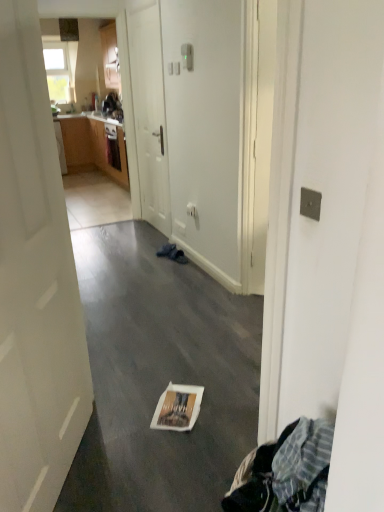
Where is `free space below white glossy magazine at center (from a real-world perspective)`? The height and width of the screenshot is (512, 384). free space below white glossy magazine at center (from a real-world perspective) is located at coordinates (170, 403).